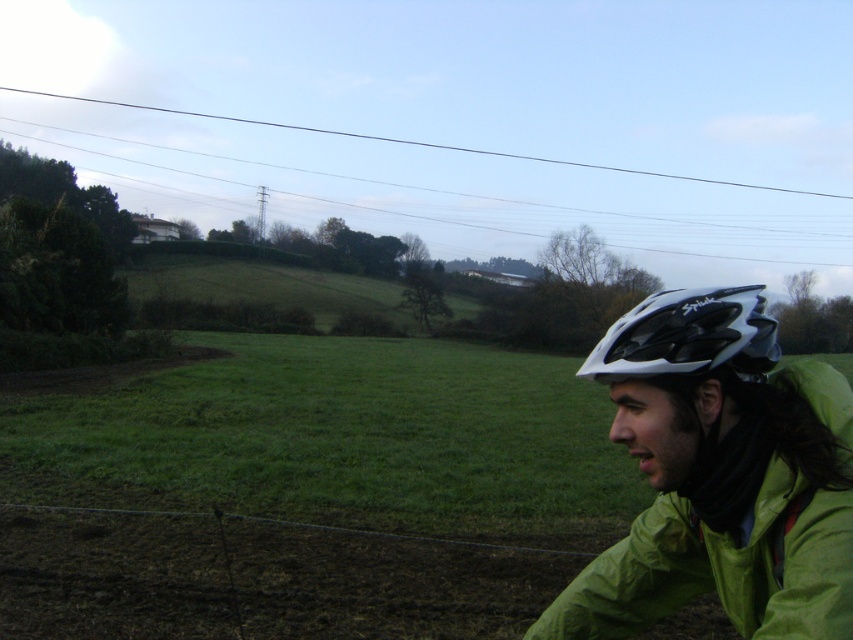
Which of these two, green matte jacket at lower right or white matte bicycle helmet at right, stands taller?

white matte bicycle helmet at right is taller.

Between green matte jacket at lower right and white matte bicycle helmet at right, which one is positioned lower?

green matte jacket at lower right is lower down.

Does point (717, 516) come farther from viewer compared to point (628, 326)?

No, it is in front of (628, 326).

This screenshot has width=853, height=640. Identify the location of green matte jacket at lower right. (720, 474).